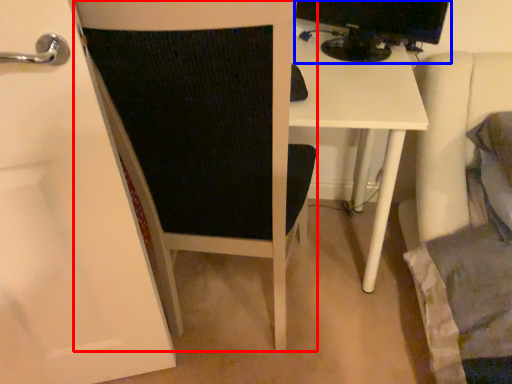
Question: Which object is further to the camera taking this photo, furniture (highlighted by a red box) or desktop computer (highlighted by a blue box)?

Choices:
 (A) furniture
 (B) desktop computer

Answer: (B)